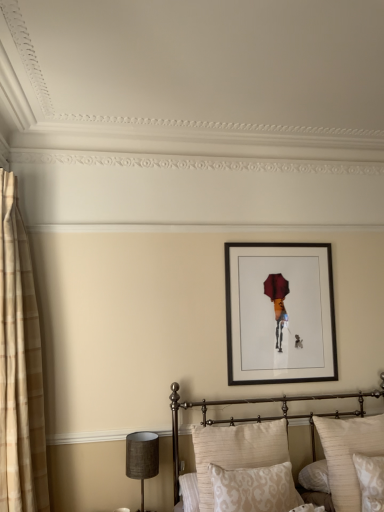
Question: Can you confirm if neutral fabric pillow at center, the fourth pillow in the right-to-left sequence, is wider than beige textured pillow at lower right, the 1th pillow when ordered from right to left?

Choices:
 (A) yes
 (B) no

Answer: (B)

Question: Are neutral fabric pillow at center, the first pillow viewed from the left, and beige textured pillow at lower right, the 1th pillow when ordered from right to left, beside each other?

Choices:
 (A) yes
 (B) no

Answer: (B)

Question: Considering the relative sizes of neutral fabric pillow at center, the first pillow viewed from the left, and beige textured pillow at lower right, which is the 4th pillow from left to right, in the image provided, is neutral fabric pillow at center, the first pillow viewed from the left, bigger than beige textured pillow at lower right, which is the 4th pillow from left to right,?

Choices:
 (A) no
 (B) yes

Answer: (B)

Question: Is neutral fabric pillow at center, the fourth pillow in the right-to-left sequence, positioned with its back to beige textured pillow at lower right, which is the 4th pillow from left to right?

Choices:
 (A) no
 (B) yes

Answer: (A)

Question: Does neutral fabric pillow at center, the fourth pillow in the right-to-left sequence, have a greater height compared to beige textured pillow at lower right, which is the 4th pillow from left to right?

Choices:
 (A) no
 (B) yes

Answer: (A)

Question: From a real-world perspective, is metallic gold bed at center positioned above or below neutral fabric pillow at center, the first pillow viewed from the left?

Choices:
 (A) above
 (B) below

Answer: (B)

Question: Is metallic gold bed at center taller or shorter than neutral fabric pillow at center, the fourth pillow in the right-to-left sequence?

Choices:
 (A) short
 (B) tall

Answer: (B)

Question: Is metallic gold bed at center inside or outside of neutral fabric pillow at center, the fourth pillow in the right-to-left sequence?

Choices:
 (A) outside
 (B) inside

Answer: (A)

Question: Does point (173, 385) appear closer or farther from the camera than point (203, 473)?

Choices:
 (A) closer
 (B) farther

Answer: (B)

Question: Is neutral fabric pillow at center, the first pillow viewed from the left, bigger or smaller than matte brown lampshade at lower left?

Choices:
 (A) small
 (B) big

Answer: (B)

Question: From the image's perspective, is neutral fabric pillow at center, the fourth pillow in the right-to-left sequence, located above or below matte brown lampshade at lower left?

Choices:
 (A) below
 (B) above

Answer: (B)

Question: From a real-world perspective, is neutral fabric pillow at center, the first pillow viewed from the left, above or below matte brown lampshade at lower left?

Choices:
 (A) below
 (B) above

Answer: (B)

Question: Relative to matte brown lampshade at lower left, is neutral fabric pillow at center, the first pillow viewed from the left, in front or behind?

Choices:
 (A) behind
 (B) front

Answer: (B)

Question: Is black matte picture frame at upper center to the left or to the right of white damask pillow at lower right, placed as the 3th pillow when sorted from left to right, in the image?

Choices:
 (A) left
 (B) right

Answer: (A)

Question: From a real-world perspective, relative to white damask pillow at lower right, marked as the second pillow in a right-to-left arrangement, is black matte picture frame at upper center vertically above or below?

Choices:
 (A) below
 (B) above

Answer: (B)